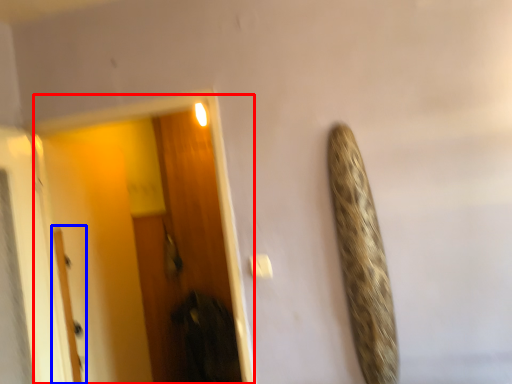
Question: Which object appears farthest to the camera in this image, screen door (highlighted by a red box) or door (highlighted by a blue box)?

Choices:
 (A) screen door
 (B) door

Answer: (B)